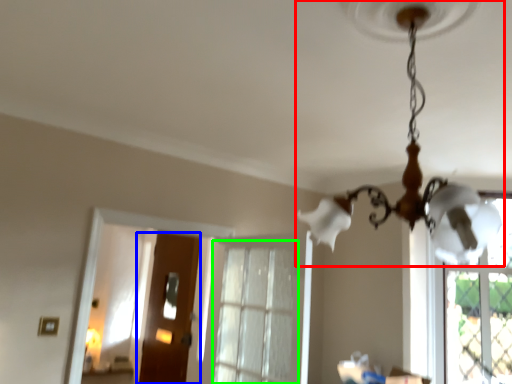
Question: Estimate the real-world distances between objects in this image. Which object is farther from lamp (highlighted by a red box), door (highlighted by a blue box) or window (highlighted by a green box)?

Choices:
 (A) door
 (B) window

Answer: (A)